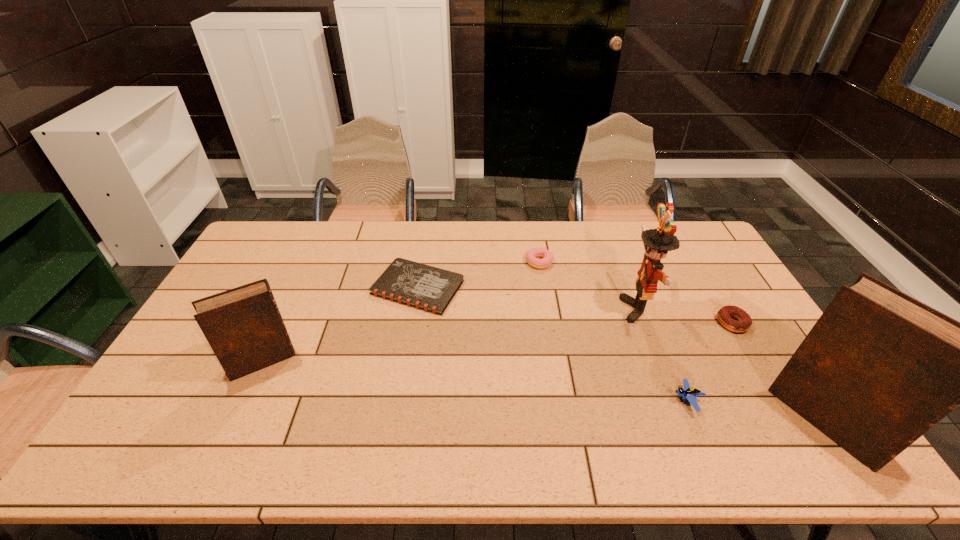
At what (x,y) coordinates should I click in order to perform the action: click on empty space that is in between the fourth shortest object and the left doughnut. Please return your answer as a coordinate pair (x, y). The image size is (960, 540). Looking at the image, I should click on (613, 332).

At what (x,y) coordinates should I click in order to perform the action: click on empty space between the right doughnut and the shorter Bible. Please return your answer as a coordinate pair (x, y). The height and width of the screenshot is (540, 960). Looking at the image, I should click on (497, 342).

The height and width of the screenshot is (540, 960). Find the location of `vacant point located between the left doughnut and the left Bible`. vacant point located between the left doughnut and the left Bible is located at coordinates (400, 312).

Identify the location of free spot between the third tallest object and the right Bible. (544, 392).

The height and width of the screenshot is (540, 960). In order to click on object that can be found as the second closest to the shortest object in this screenshot , I will do `click(547, 257)`.

Where is `object that ranks as the sixth closest to the shortest object`? The height and width of the screenshot is (540, 960). object that ranks as the sixth closest to the shortest object is located at coordinates (879, 368).

I want to click on free spot that satisfies the following two spatial constraints: 1. on the back side of the right doughnut; 2. on the left side of the third tallest object, so click(280, 323).

The width and height of the screenshot is (960, 540). Identify the location of free space that satisfies the following two spatial constraints: 1. on the back side of the fifth object from right to left; 2. on the right side of the shortest object. click(421, 262).

Where is `blank area in the image that satisfies the following two spatial constraints: 1. on the front-facing side of the taller Bible; 2. on the left side of the Lego`? blank area in the image that satisfies the following two spatial constraints: 1. on the front-facing side of the taller Bible; 2. on the left side of the Lego is located at coordinates (696, 421).

What are the coordinates of `vacant region that satisfies the following two spatial constraints: 1. on the front-facing side of the nutcracker; 2. on the back side of the right doughnut` in the screenshot? It's located at (643, 323).